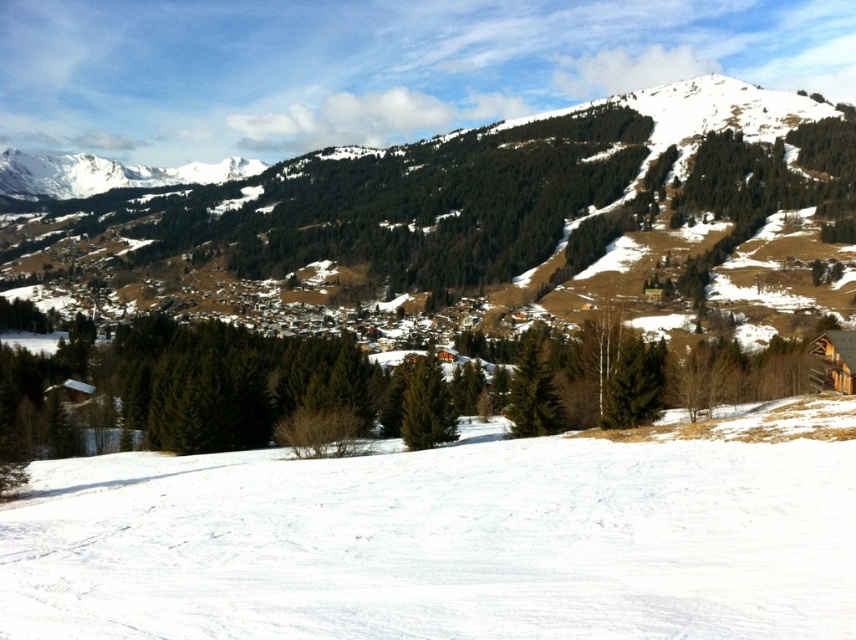
Question: Which object is closer to the camera taking this photo?

Choices:
 (A) white snow ski slope at lower center
 (B) snowy forested mountain at center

Answer: (A)

Question: In this image, where is white snow ski slope at lower center located relative to snowy forested mountain at center?

Choices:
 (A) right
 (B) left

Answer: (A)

Question: Can you confirm if white snow ski slope at lower center is bigger than snowy forested mountain at center?

Choices:
 (A) no
 (B) yes

Answer: (A)

Question: Which point is farther to the camera?

Choices:
 (A) snowy forested mountain at center
 (B) white snow ski slope at lower center

Answer: (A)

Question: Can you confirm if white snow ski slope at lower center is thinner than snowy forested mountain at center?

Choices:
 (A) no
 (B) yes

Answer: (B)